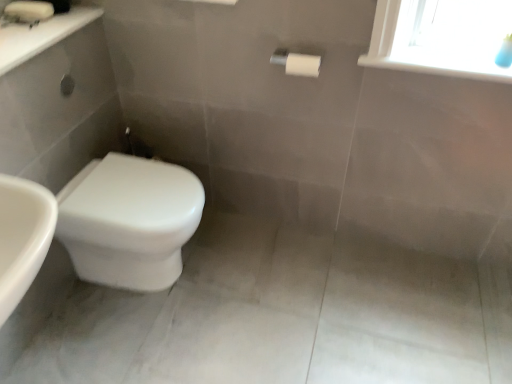
Question: Can you confirm if white glossy toilet at lower left is wider than white glossy sink at upper left?

Choices:
 (A) yes
 (B) no

Answer: (A)

Question: Can you confirm if white glossy toilet at lower left is positioned to the left of white glossy sink at upper left?

Choices:
 (A) yes
 (B) no

Answer: (B)

Question: From a real-world perspective, is white glossy toilet at lower left below white glossy sink at upper left?

Choices:
 (A) yes
 (B) no

Answer: (A)

Question: Is the surface of white glossy toilet at lower left in direct contact with white glossy sink at upper left?

Choices:
 (A) no
 (B) yes

Answer: (A)

Question: Is white glossy toilet at lower left positioned behind white glossy sink at upper left?

Choices:
 (A) no
 (B) yes

Answer: (B)

Question: From the image's perspective, is white glossy toilet at lower left on top of white glossy sink at upper left?

Choices:
 (A) yes
 (B) no

Answer: (B)

Question: Is white glossy sink at upper left wider than white glossy toilet at lower left?

Choices:
 (A) no
 (B) yes

Answer: (A)

Question: Considering the relative sizes of white glossy sink at upper left and white glossy toilet at lower left in the image provided, is white glossy sink at upper left shorter than white glossy toilet at lower left?

Choices:
 (A) yes
 (B) no

Answer: (A)

Question: Is white glossy sink at upper left facing towards white glossy toilet at lower left?

Choices:
 (A) yes
 (B) no

Answer: (B)

Question: Is white glossy sink at upper left closer to camera compared to white glossy toilet at lower left?

Choices:
 (A) no
 (B) yes

Answer: (B)

Question: Does white glossy sink at upper left contain white glossy toilet at lower left?

Choices:
 (A) no
 (B) yes

Answer: (A)

Question: Is white glossy sink at upper left at the left side of white glossy toilet at lower left?

Choices:
 (A) no
 (B) yes

Answer: (B)

Question: Considering the relative sizes of white glossy sink at upper left and white plastic window sill at upper right in the image provided, is white glossy sink at upper left smaller than white plastic window sill at upper right?

Choices:
 (A) yes
 (B) no

Answer: (B)